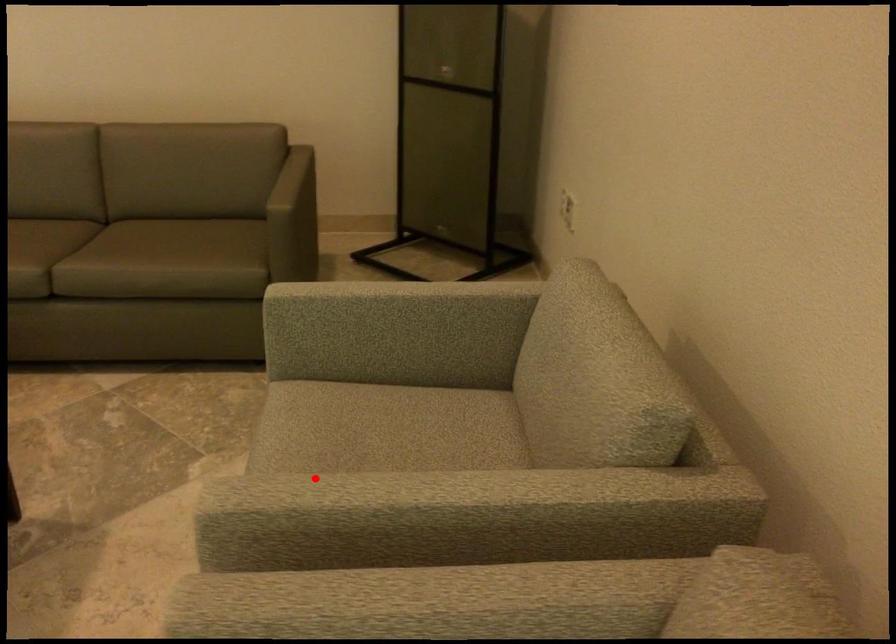
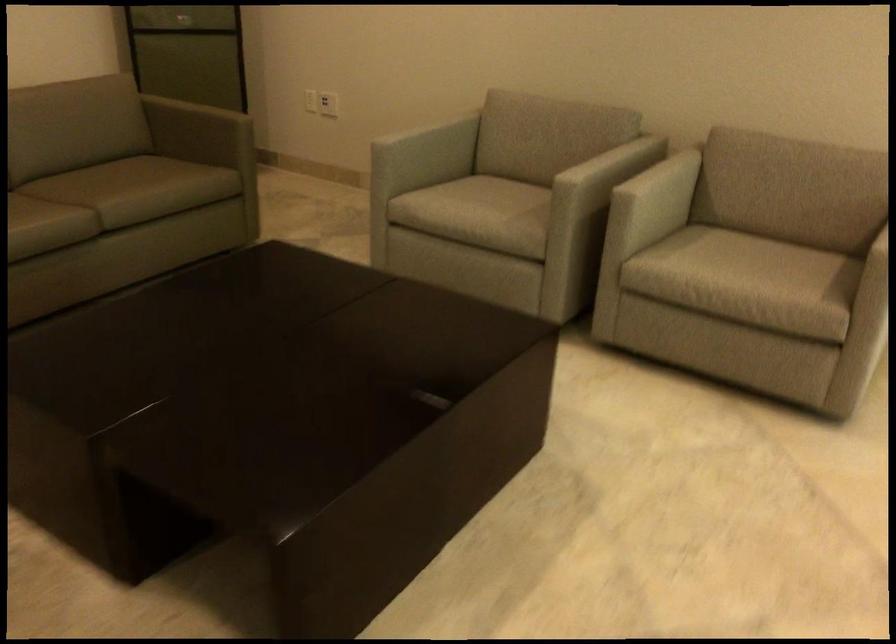
In the second image, find the point that corresponds to the highlighted location in the first image.

(480, 207)